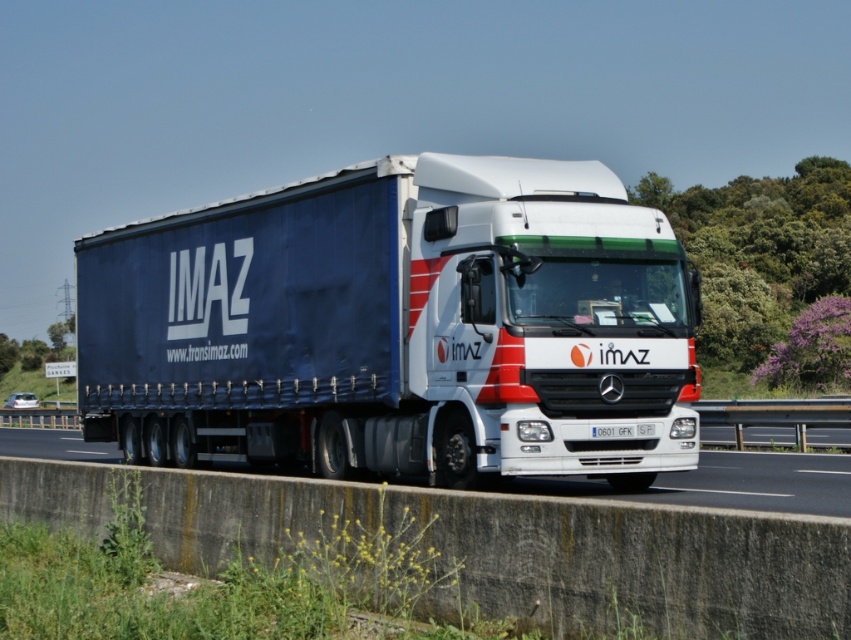
Question: Is concrete barrier at lower center positioned in front of white plastic license plate at center?

Choices:
 (A) yes
 (B) no

Answer: (A)

Question: Can you confirm if concrete barrier at lower center is positioned to the left of white plastic license plate at center?

Choices:
 (A) yes
 (B) no

Answer: (A)

Question: Can you confirm if blue fabric trailer truck at center is bigger than white plastic license plate at center?

Choices:
 (A) yes
 (B) no

Answer: (A)

Question: Which object is farther from the camera taking this photo?

Choices:
 (A) white plastic license plate at center
 (B) blue fabric trailer truck at center

Answer: (A)

Question: Which object appears farthest from the camera in this image?

Choices:
 (A) concrete barrier at lower center
 (B) blue fabric trailer truck at center
 (C) white plastic license plate at center

Answer: (C)

Question: Among these objects, which one is farthest from the camera?

Choices:
 (A) white plastic license plate at center
 (B) blue fabric trailer truck at center
 (C) concrete barrier at lower center

Answer: (A)